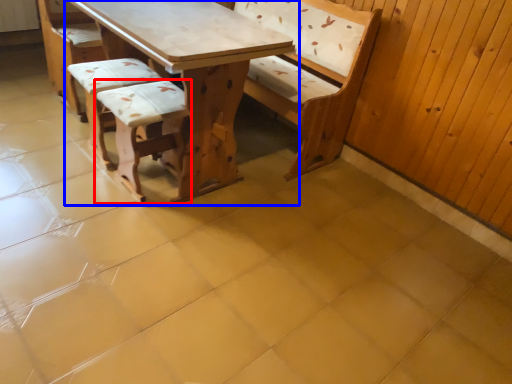
Question: Which object appears farthest to the camera in this image, armchair (highlighted by a red box) or table (highlighted by a blue box)?

Choices:
 (A) armchair
 (B) table

Answer: (A)